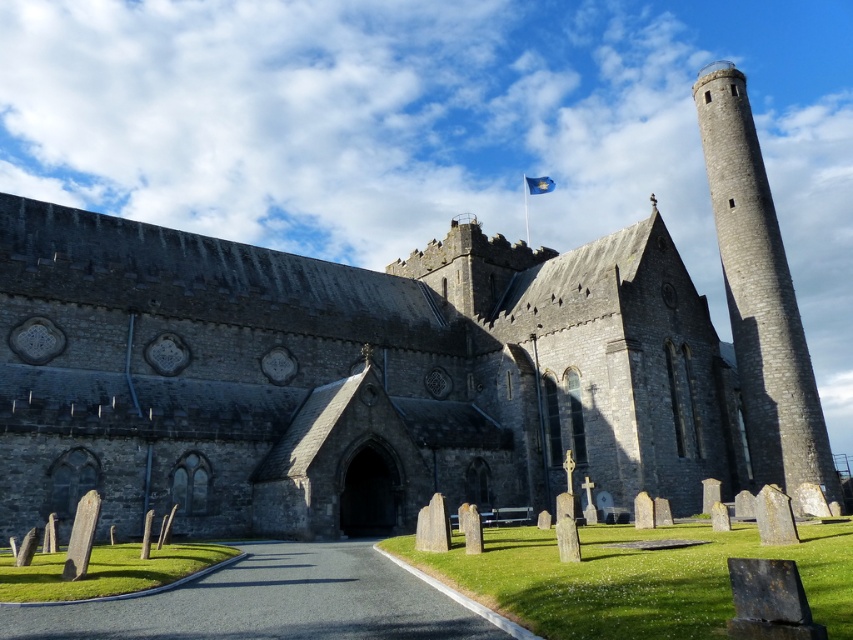
Who is positioned more to the right, gray stone tower at right or blue fabric flag at upper center?

gray stone tower at right is more to the right.

Does point (720, 140) come farther from viewer compared to point (531, 193)?

No.

Locate an element on the screen. gray stone tower at right is located at coordinates pos(759,294).

Which is in front, point (781, 417) or point (90, 545)?

Point (90, 545) is more forward.

Between gray stone tower at right and smooth gray stone tombstone at lower left, which one is positioned higher?

Positioned higher is gray stone tower at right.

Is point (764, 324) less distant than point (74, 545)?

No, (764, 324) is behind (74, 545).

Find the location of a particular element. This screenshot has height=640, width=853. gray stone tower at right is located at coordinates (759, 294).

Can you confirm if smooth gray stone tombstone at lower left is positioned above blue fabric flag at upper center?

No, smooth gray stone tombstone at lower left is not above blue fabric flag at upper center.

From the picture: Which of these two, smooth gray stone tombstone at lower left or blue fabric flag at upper center, stands taller?

blue fabric flag at upper center

In the scene shown: Who is more forward, [84,518] or [540,189]?

Point [84,518] is more forward.

This screenshot has width=853, height=640. I want to click on smooth gray stone tombstone at lower left, so click(x=80, y=536).